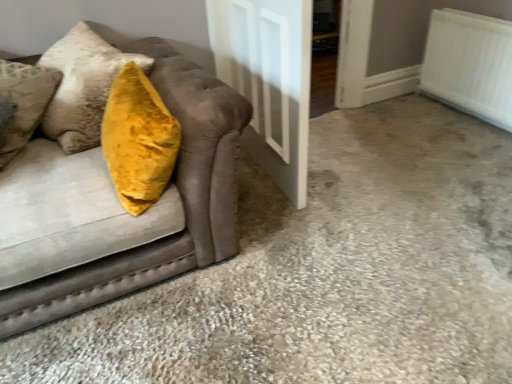
Question: Is white glossy door at center taller than velvet mustard pillow at left?

Choices:
 (A) no
 (B) yes

Answer: (B)

Question: Does white glossy door at center come behind velvet mustard pillow at left?

Choices:
 (A) no
 (B) yes

Answer: (B)

Question: Can you confirm if white glossy door at center is shorter than velvet mustard pillow at left?

Choices:
 (A) no
 (B) yes

Answer: (A)

Question: Is white glossy door at center to the left of velvet mustard pillow at left from the viewer's perspective?

Choices:
 (A) no
 (B) yes

Answer: (A)

Question: Is white glossy door at center not within velvet mustard pillow at left?

Choices:
 (A) yes
 (B) no

Answer: (A)

Question: Is velvet mustard pillow at left at the back of white glossy door at center?

Choices:
 (A) no
 (B) yes

Answer: (B)

Question: Is white glossy door at center far from white textured radiator at upper right?

Choices:
 (A) no
 (B) yes

Answer: (B)

Question: From the image's perspective, is white glossy door at center located beneath white textured radiator at upper right?

Choices:
 (A) yes
 (B) no

Answer: (A)

Question: Is the surface of white glossy door at center in direct contact with white textured radiator at upper right?

Choices:
 (A) yes
 (B) no

Answer: (B)

Question: From a real-world perspective, is white glossy door at center over white textured radiator at upper right?

Choices:
 (A) no
 (B) yes

Answer: (B)

Question: Is white glossy door at center outside white textured radiator at upper right?

Choices:
 (A) no
 (B) yes

Answer: (B)

Question: Can you confirm if white glossy door at center is smaller than white textured radiator at upper right?

Choices:
 (A) yes
 (B) no

Answer: (B)

Question: Considering the relative sizes of white textured radiator at upper right and white glossy door at center in the image provided, is white textured radiator at upper right smaller than white glossy door at center?

Choices:
 (A) no
 (B) yes

Answer: (B)